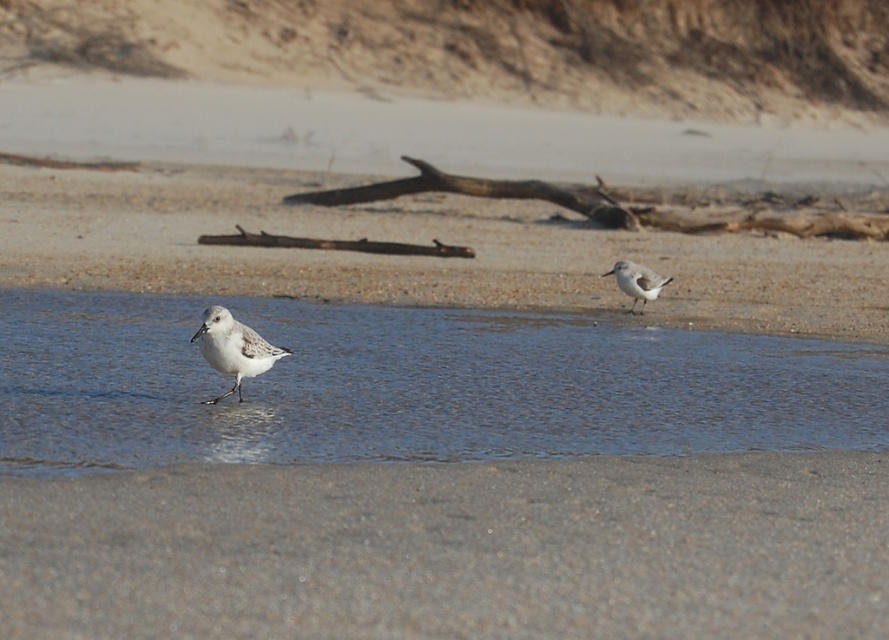
You are a photographer trying to capture both the brown rough log at center and the white matte bird at center in the same frame. Based on their positions, which object is closer to the left edge of the photo?

The white matte bird at center is closer to the left edge of the photo because the brown rough log at center is positioned to its right, meaning the bird is to the left of the log.

You are a photographer aiming to capture the white matte bird at center. You are standing at the point marked by coordinates point (233, 348). Can you confirm if the bird is directly in front of you?

The white matte bird at center is located at point (233, 348), so yes, the bird is directly in front of you at that coordinate.